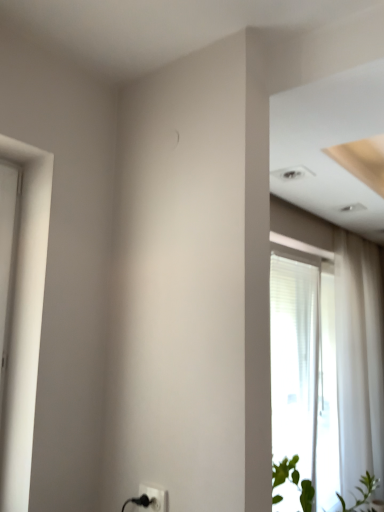
Describe the element at coordinates (359, 361) in the screenshot. The height and width of the screenshot is (512, 384). I see `white sheer curtain at right` at that location.

Measure the distance between black plastic electric outlet at lower center and camera.

They are 1.32 meters apart.

Find the location of a particular element. The height and width of the screenshot is (512, 384). white sheer curtain at right is located at coordinates (359, 361).

Does black plastic electric outlet at lower center have a lesser width compared to green leafy plant at lower right?

Yes, black plastic electric outlet at lower center is thinner than green leafy plant at lower right.

Locate an element on the screen. The width and height of the screenshot is (384, 512). houseplant in front of the black plastic electric outlet at lower center is located at coordinates (293, 480).

Choose the correct answer: Is black plastic electric outlet at lower center inside green leafy plant at lower right or outside it?

black plastic electric outlet at lower center is spatially situated outside green leafy plant at lower right.

Can you tell me how much black plastic electric outlet at lower center and green leafy plant at lower right differ in facing direction?

Result: 118 degrees.

Considering the relative sizes of green leafy plant at lower right and black plastic electric outlet at lower center in the image provided, is green leafy plant at lower right thinner than black plastic electric outlet at lower center?

No.

How many degrees apart are the facing directions of green leafy plant at lower right and black plastic electric outlet at lower center?

The facing directions of green leafy plant at lower right and black plastic electric outlet at lower center are 118 degrees apart.

Who is taller, green leafy plant at lower right or black plastic electric outlet at lower center?

Standing taller between the two is green leafy plant at lower right.

Consider the image. Who is bigger, green leafy plant at lower right or black plastic electric outlet at lower center?

With larger size is green leafy plant at lower right.

Which object is closer to the camera taking this photo, black plastic electric outlet at lower center or transparent glass window at right?

black plastic electric outlet at lower center is more forward.

Are black plastic electric outlet at lower center and transparent glass window at right making contact?

No, black plastic electric outlet at lower center is not next to transparent glass window at right.

Does black plastic electric outlet at lower center have a lesser height compared to transparent glass window at right?

Indeed, black plastic electric outlet at lower center has a lesser height compared to transparent glass window at right.

Locate an element on the screen. electric outlet above the transparent glass window at right (from the image's perspective) is located at coordinates (154, 498).

Does point (360, 447) come in front of point (155, 500)?

No.

In terms of height, does white sheer curtain at right look taller or shorter compared to black plastic electric outlet at lower center?

In the image, white sheer curtain at right appears to be taller than black plastic electric outlet at lower center.

Would you say white sheer curtain at right is a long distance from black plastic electric outlet at lower center?

Indeed, white sheer curtain at right is not near black plastic electric outlet at lower center.

You are a GUI agent. You are given a task and a screenshot of the screen. Output one action in this format:
    pyautogui.click(x=<x>, y=<y>)
    Task: Click on the curtain located above the black plastic electric outlet at lower center (from a real-world perspective)
    The height and width of the screenshot is (512, 384).
    Given the screenshot: What is the action you would take?
    pyautogui.click(x=359, y=361)

Does green leafy plant at lower right have a smaller size compared to white sheer curtain at right?

Yes.

From a real-world perspective, relative to white sheer curtain at right, is green leafy plant at lower right vertically above or below?

From a real-world perspective, green leafy plant at lower right is physically below white sheer curtain at right.

Considering the relative positions of green leafy plant at lower right and white sheer curtain at right in the image provided, is green leafy plant at lower right behind white sheer curtain at right?

No.

Is green leafy plant at lower right completely or partially outside of white sheer curtain at right?

Absolutely, green leafy plant at lower right is external to white sheer curtain at right.

Do you think transparent glass window at right is within white sheer curtain at right, or outside of it?

transparent glass window at right exists outside the volume of white sheer curtain at right.

Is point (288, 244) in front of point (346, 467)?

Yes, it is.

Which of these two, transparent glass window at right or white sheer curtain at right, is bigger?

transparent glass window at right is bigger.

From their relative heights in the image, would you say white sheer curtain at right is taller or shorter than green leafy plant at lower right?

white sheer curtain at right is taller than green leafy plant at lower right.

Is white sheer curtain at right beside green leafy plant at lower right?

No, white sheer curtain at right is not touching green leafy plant at lower right.

Consider the image. Considering the sizes of objects white sheer curtain at right and green leafy plant at lower right in the image provided, who is thinner, white sheer curtain at right or green leafy plant at lower right?

Thinner between the two is white sheer curtain at right.

I want to click on electric outlet on the left of green leafy plant at lower right, so click(154, 498).

This screenshot has height=512, width=384. What are the coordinates of `houseplant in front of the black plastic electric outlet at lower center` in the screenshot? It's located at (293, 480).

When comparing their distances from black plastic electric outlet at lower center, does white sheer curtain at right or transparent glass window at right seem further?

Based on the image, white sheer curtain at right appears to be further to black plastic electric outlet at lower center.

Looking at the image, which one is located closer to white sheer curtain at right, black plastic electric outlet at lower center or transparent glass window at right?

transparent glass window at right is closer to white sheer curtain at right.

Which object lies further to the anchor point green leafy plant at lower right, white sheer curtain at right or transparent glass window at right?

The object further to green leafy plant at lower right is white sheer curtain at right.

Which object lies nearer to the anchor point green leafy plant at lower right, black plastic electric outlet at lower center or transparent glass window at right?

The object closer to green leafy plant at lower right is black plastic electric outlet at lower center.

Based on the photo, looking at the image, which one is located closer to green leafy plant at lower right, transparent glass window at right or black plastic electric outlet at lower center?

black plastic electric outlet at lower center lies closer to green leafy plant at lower right than the other object.

In the scene shown: When comparing their distances from white sheer curtain at right, does transparent glass window at right or green leafy plant at lower right seem closer?

transparent glass window at right.

When comparing their distances from transparent glass window at right, does white sheer curtain at right or green leafy plant at lower right seem further?

green leafy plant at lower right is further to transparent glass window at right.

Estimate the real-world distances between objects in this image. Which object is further from black plastic electric outlet at lower center, green leafy plant at lower right or transparent glass window at right?

Based on the image, transparent glass window at right appears to be further to black plastic electric outlet at lower center.

At what (x,y) coordinates should I click in order to perform the action: click on window located between black plastic electric outlet at lower center and white sheer curtain at right in the depth direction. Please return your answer as a coordinate pair (x, y). The width and height of the screenshot is (384, 512). Looking at the image, I should click on (300, 230).

Locate an element on the screen. electric outlet positioned between green leafy plant at lower right and transparent glass window at right from near to far is located at coordinates (154, 498).

Identify the location of electric outlet between green leafy plant at lower right and white sheer curtain at right from front to back. This screenshot has width=384, height=512. (154, 498).

The image size is (384, 512). In order to click on window between green leafy plant at lower right and white sheer curtain at right in the front-back direction in this screenshot , I will do `click(300, 230)`.